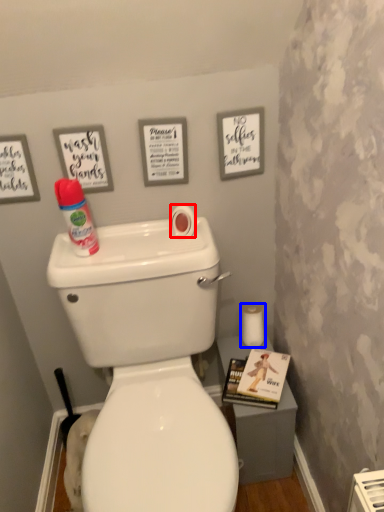
Question: Which point is closer to the camera, toilet paper (highlighted by a red box) or toilet paper (highlighted by a blue box)?

Choices:
 (A) toilet paper
 (B) toilet paper

Answer: (A)